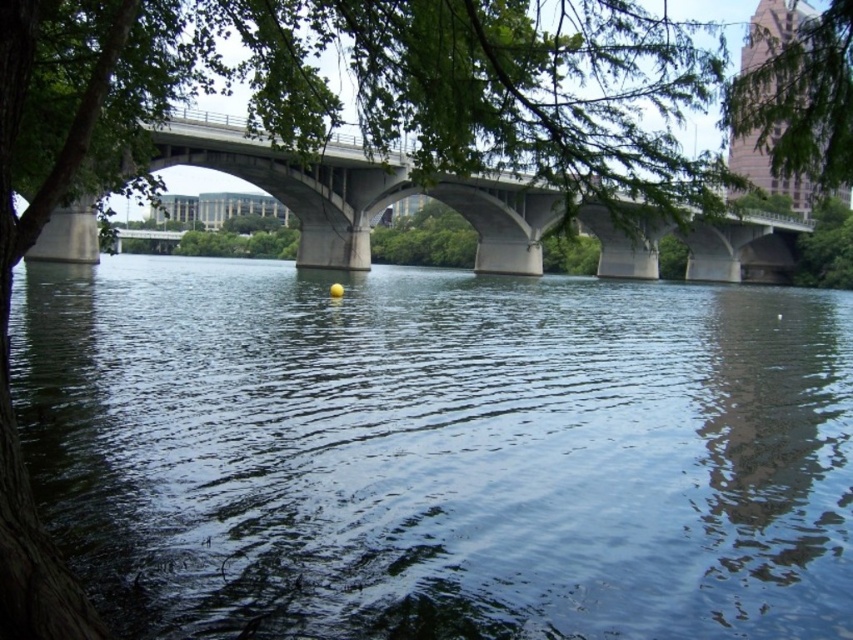
Question: Does dark blue water at center have a lesser width compared to concrete bridge at center?

Choices:
 (A) no
 (B) yes

Answer: (B)

Question: Among these objects, which one is nearest to the camera?

Choices:
 (A) dark blue water at center
 (B) concrete bridge at center

Answer: (A)

Question: Which point is closer to the camera?

Choices:
 (A) (221, 170)
 (B) (474, 449)

Answer: (B)

Question: Is dark blue water at center thinner than concrete bridge at center?

Choices:
 (A) no
 (B) yes

Answer: (B)

Question: Is dark blue water at center bigger than concrete bridge at center?

Choices:
 (A) no
 (B) yes

Answer: (A)